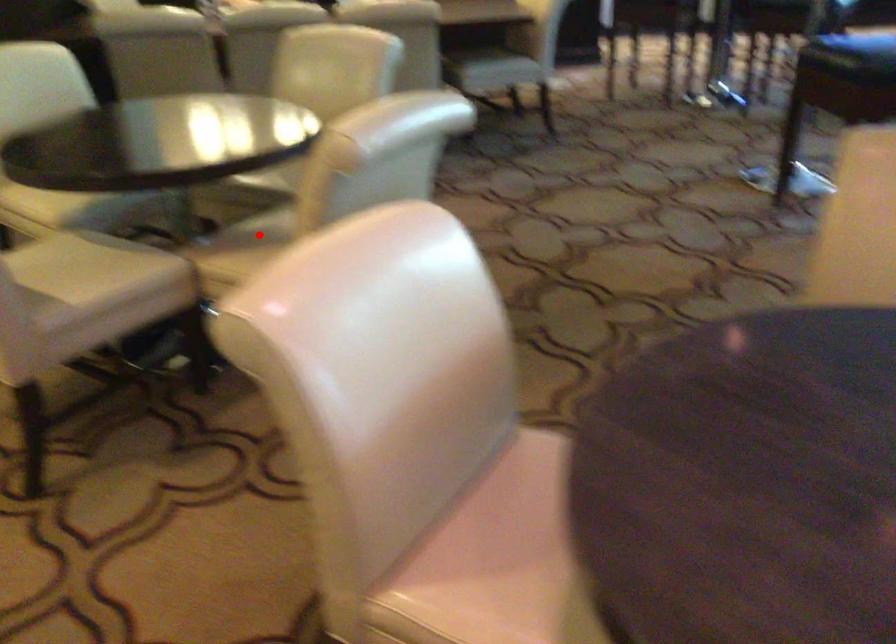
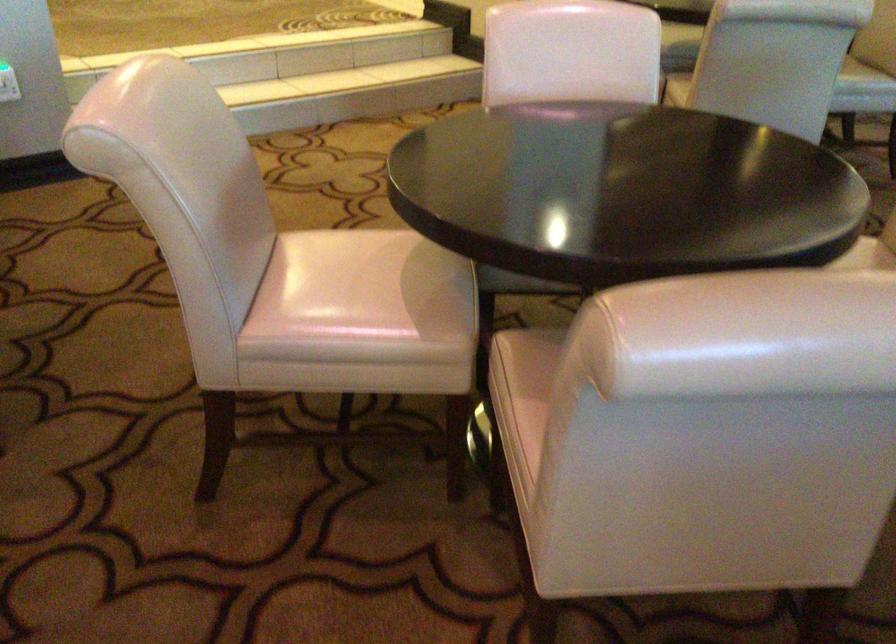
Question: I am providing you with two images of the same scene from different viewpoints. A red point is marked on the first image. Can you still see the location of the red point in image 2?

Choices:
 (A) Yes
 (B) No

Answer: (B)